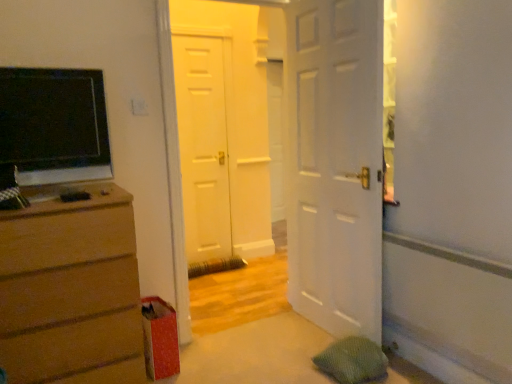
What do you see at coordinates (334, 163) in the screenshot?
I see `white matte door at center, the 1th door in the front-to-back sequence` at bounding box center [334, 163].

Identify the location of white matte door at center, placed as the third door when sorted from front to back. This screenshot has height=384, width=512. (203, 145).

At what (x,y) coordinates should I click in order to perform the action: click on white matte door at center, the 1th door in the front-to-back sequence. Please return your answer as a coordinate pair (x, y). The width and height of the screenshot is (512, 384). Looking at the image, I should click on (334, 163).

The image size is (512, 384). What are the coordinates of `door that is in front of the white matte door at center, the 2th door from the front` in the screenshot? It's located at (334, 163).

Does white matte door at center, the 1th door in the front-to-back sequence, have a greater width compared to white matte door at center, the 2th door positioned from the back?

No.

In the scene shown: From the image's perspective, is white matte door at center, the 1th door in the front-to-back sequence, located beneath white matte door at center, the 2th door positioned from the back?

Yes, from the image's perspective, white matte door at center, the 1th door in the front-to-back sequence, is below white matte door at center, the 2th door positioned from the back.

Considering the positions of objects white matte door at center, the third door viewed from the back, and white matte door at center, the 1th door in the back-to-front sequence, in the image provided, who is more to the left, white matte door at center, the third door viewed from the back, or white matte door at center, the 1th door in the back-to-front sequence,?

From the viewer's perspective, white matte door at center, the 1th door in the back-to-front sequence, appears more on the left side.

From the image's perspective, which object appears higher, white matte door at center, the 1th door in the front-to-back sequence, or white matte door at center, the 1th door in the back-to-front sequence?

white matte door at center, the 1th door in the back-to-front sequence.

Which is behind, point (360, 295) or point (188, 243)?

The point (188, 243) is behind.

Looking at this image, is white matte door at center, placed as the third door when sorted from front to back, inside white matte door at center, the third door viewed from the back?

That's incorrect, white matte door at center, placed as the third door when sorted from front to back, is not inside white matte door at center, the third door viewed from the back.

Considering the positions of objects white matte door at center, placed as the third door when sorted from front to back, and white matte door at center, the 1th door in the front-to-back sequence, in the image provided, who is more to the right, white matte door at center, placed as the third door when sorted from front to back, or white matte door at center, the 1th door in the front-to-back sequence,?

Positioned to the right is white matte door at center, the 1th door in the front-to-back sequence.

Between white matte door at center, placed as the third door when sorted from front to back, and white matte door at center, the 1th door in the front-to-back sequence, which one has smaller size?

With smaller size is white matte door at center, placed as the third door when sorted from front to back.

From the image's perspective, who appears lower, white matte door at center, placed as the third door when sorted from front to back, or white matte door at center, the third door viewed from the back?

white matte door at center, the third door viewed from the back.

Is white matte door at center, the 1th door in the back-to-front sequence, thinner than white matte door at center, the third door viewed from the back?

Correct, the width of white matte door at center, the 1th door in the back-to-front sequence, is less than that of white matte door at center, the third door viewed from the back.

Is white matte door at center, the 2th door from the front, positioned far away from matte brown dresser at left?

Indeed, white matte door at center, the 2th door from the front, is not near matte brown dresser at left.

Is white matte door at center, the 2th door from the front, wider than matte brown dresser at left?

Incorrect, the width of white matte door at center, the 2th door from the front, does not surpass that of matte brown dresser at left.

Looking at this image, from a real-world perspective, is white matte door at center, the 2th door positioned from the back, above or below matte brown dresser at left?

Clearly, from a real-world perspective, white matte door at center, the 2th door positioned from the back, is above matte brown dresser at left.

Does point (225, 164) appear closer or farther from the camera than point (115, 242)?

Point (225, 164) appears to be farther away from the viewer than point (115, 242).

Is white matte door at center, placed as the third door when sorted from front to back, in contact with matte brown dresser at left?

No, white matte door at center, placed as the third door when sorted from front to back, is not with matte brown dresser at left.

In the scene shown: Considering the sizes of white matte door at center, placed as the third door when sorted from front to back, and matte brown dresser at left in the image, is white matte door at center, placed as the third door when sorted from front to back, bigger or smaller than matte brown dresser at left?

In the image, white matte door at center, placed as the third door when sorted from front to back, appears to be smaller than matte brown dresser at left.

Is white matte door at center, placed as the third door when sorted from front to back, aimed at matte brown dresser at left?

No.

Which is more to the right, white matte door at center, the 1th door in the back-to-front sequence, or matte brown dresser at left?

Positioned to the right is white matte door at center, the 1th door in the back-to-front sequence.

Considering the sizes of objects white matte door at center, the 2th door positioned from the back, and white matte door at center, the third door viewed from the back, in the image provided, who is taller, white matte door at center, the 2th door positioned from the back, or white matte door at center, the third door viewed from the back,?

Standing taller between the two is white matte door at center, the 2th door positioned from the back.

I want to click on the 1st door above the white matte door at center, the 1th door in the front-to-back sequence (from the image's perspective), so click(x=222, y=130).

From the image's perspective, between white matte door at center, the 2th door positioned from the back, and white matte door at center, the 1th door in the front-to-back sequence, which one is located above?

white matte door at center, the 2th door positioned from the back, is shown above in the image.

Is white matte door at center, the 2th door positioned from the back, situated inside white matte door at center, the 1th door in the front-to-back sequence, or outside?

The correct answer is: outside.

Between white matte door at center, the 2th door positioned from the back, and white matte door at center, placed as the third door when sorted from front to back, which one is positioned behind?

white matte door at center, placed as the third door when sorted from front to back, is further away from the camera.

Between white matte door at center, the 2th door positioned from the back, and white matte door at center, the 1th door in the back-to-front sequence, which one appears on the right side from the viewer's perspective?

Positioned to the right is white matte door at center, the 2th door positioned from the back.

Is white matte door at center, the 2th door positioned from the back, with white matte door at center, the 1th door in the back-to-front sequence?

Yes, white matte door at center, the 2th door positioned from the back, is right next to white matte door at center, the 1th door in the back-to-front sequence, and making contact.

From the image's perspective, which is below, white matte door at center, the 2th door from the front, or white matte door at center, placed as the third door when sorted from front to back?

white matte door at center, the 2th door from the front, from the image's perspective.

You are a GUI agent. You are given a task and a screenshot of the screen. Output one action in this format:
    pyautogui.click(x=<x>, y=<y>)
    Task: Click on the door that is the 1st one when counting leftward from the white matte door at center, the 1th door in the front-to-back sequence
    The image size is (512, 384).
    Given the screenshot: What is the action you would take?
    pyautogui.click(x=222, y=130)

From the white matte door at center, the 1th door in the back-to-front sequence, count 2nd door to the right and point to it. Please provide its 2D coordinates.

[(334, 163)]

When comparing their distances from white matte door at center, the 2th door from the front, does matte brown dresser at left or white matte door at center, the 1th door in the back-to-front sequence, seem closer?

white matte door at center, the 1th door in the back-to-front sequence, lies closer to white matte door at center, the 2th door from the front, than the other object.

Which object lies nearer to the anchor point white matte door at center, the 2th door from the front, white matte door at center, placed as the third door when sorted from front to back, or white matte door at center, the third door viewed from the back?

white matte door at center, placed as the third door when sorted from front to back.

Considering their positions, is white matte door at center, the 2th door from the front, positioned closer to white matte door at center, the 1th door in the back-to-front sequence, than white matte door at center, the third door viewed from the back?

The object closer to white matte door at center, the 1th door in the back-to-front sequence, is white matte door at center, the 2th door from the front.

Which object lies further to the anchor point matte brown dresser at left, white matte door at center, the 2th door from the front, or white matte door at center, the 1th door in the front-to-back sequence?

white matte door at center, the 2th door from the front.

Estimate the real-world distances between objects in this image. Which object is further from white matte door at center, the 2th door from the front, white matte door at center, the 1th door in the front-to-back sequence, or white matte door at center, placed as the third door when sorted from front to back?

white matte door at center, the 1th door in the front-to-back sequence.

Based on their spatial positions, is white matte door at center, the 2th door from the front, or matte brown dresser at left further from white matte door at center, the 1th door in the front-to-back sequence?

Among the two, white matte door at center, the 2th door from the front, is located further to white matte door at center, the 1th door in the front-to-back sequence.

Looking at the image, which one is located further to white matte door at center, the 1th door in the front-to-back sequence, matte brown dresser at left or white matte door at center, the 1th door in the back-to-front sequence?

white matte door at center, the 1th door in the back-to-front sequence, is further to white matte door at center, the 1th door in the front-to-back sequence.

Estimate the real-world distances between objects in this image. Which object is closer to matte brown dresser at left, white matte door at center, the 1th door in the front-to-back sequence, or white matte door at center, the 1th door in the back-to-front sequence?

Based on the image, white matte door at center, the 1th door in the front-to-back sequence, appears to be nearer to matte brown dresser at left.

Identify the location of door between white matte door at center, the third door viewed from the back, and white matte door at center, the 1th door in the back-to-front sequence, along the z-axis. This screenshot has width=512, height=384. (222, 130).